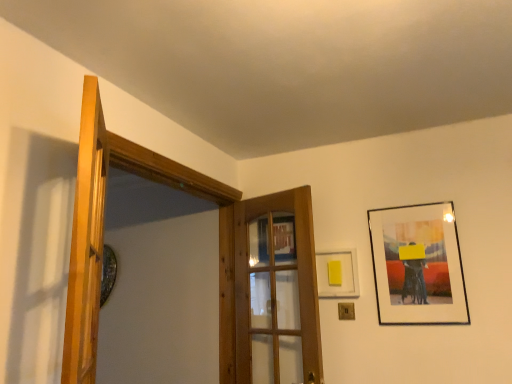
Question: Considering the relative sizes of matte black picture frame at upper right, which is the first picture frame in right-to-left order, and wooden door at center, which is the 2th door in left-to-right order, in the image provided, is matte black picture frame at upper right, which is the first picture frame in right-to-left order, wider than wooden door at center, which is the 2th door in left-to-right order,?

Choices:
 (A) no
 (B) yes

Answer: (A)

Question: Is the position of matte black picture frame at upper right, which is the first picture frame in right-to-left order, less distant than that of wooden door at center, which is the first door from back to front?

Choices:
 (A) no
 (B) yes

Answer: (A)

Question: Is matte black picture frame at upper right, which is the first picture frame in right-to-left order, facing towards wooden door at center, acting as the 1th door starting from the right?

Choices:
 (A) no
 (B) yes

Answer: (A)

Question: From the image's perspective, would you say matte black picture frame at upper right, the second picture frame from the left, is positioned over wooden door at center, arranged as the 2th door when viewed from the front?

Choices:
 (A) no
 (B) yes

Answer: (B)

Question: Is matte black picture frame at upper right, which is the first picture frame in right-to-left order, at the left side of wooden door at center, arranged as the 2th door when viewed from the front?

Choices:
 (A) yes
 (B) no

Answer: (B)

Question: Is wooden door at center, arranged as the 2th door when viewed from the front, inside the boundaries of wooden door at left, the second door viewed from the back, or outside?

Choices:
 (A) inside
 (B) outside

Answer: (B)

Question: Is wooden door at center, which is the 2th door in left-to-right order, bigger or smaller than wooden door at left, the second door viewed from the back?

Choices:
 (A) small
 (B) big

Answer: (B)

Question: In terms of width, does wooden door at center, arranged as the 2th door when viewed from the front, look wider or thinner when compared to wooden door at left, the second door viewed from the back?

Choices:
 (A) wide
 (B) thin

Answer: (B)

Question: From the image's perspective, relative to wooden door at left, the second door from the right, is wooden door at center, which is the first door from back to front, above or below?

Choices:
 (A) below
 (B) above

Answer: (A)

Question: Is yellow matte picture frame at upper right, positioned as the 2th picture frame in right-to-left order, in front of or behind matte black picture frame at upper right, the second picture frame from the left, in the image?

Choices:
 (A) behind
 (B) front

Answer: (A)

Question: Considering the relative positions of yellow matte picture frame at upper right, positioned as the 2th picture frame in right-to-left order, and matte black picture frame at upper right, the second picture frame from the left, in the image provided, is yellow matte picture frame at upper right, positioned as the 2th picture frame in right-to-left order, to the left or to the right of matte black picture frame at upper right, the second picture frame from the left,?

Choices:
 (A) left
 (B) right

Answer: (A)

Question: In terms of size, does yellow matte picture frame at upper right, positioned as the 2th picture frame in right-to-left order, appear bigger or smaller than matte black picture frame at upper right, which is the first picture frame in right-to-left order?

Choices:
 (A) small
 (B) big

Answer: (A)

Question: From a real-world perspective, relative to matte black picture frame at upper right, the second picture frame from the left, is yellow matte picture frame at upper right, the first picture frame positioned from the left, vertically above or below?

Choices:
 (A) above
 (B) below

Answer: (B)

Question: Which is correct: yellow matte picture frame at upper right, positioned as the 2th picture frame in right-to-left order, is inside wooden door at left, which is the 1th door in front-to-back order, or outside of it?

Choices:
 (A) outside
 (B) inside

Answer: (A)

Question: Considering the positions of yellow matte picture frame at upper right, positioned as the 2th picture frame in right-to-left order, and wooden door at left, the second door from the right, in the image, is yellow matte picture frame at upper right, positioned as the 2th picture frame in right-to-left order, wider or thinner than wooden door at left, the second door from the right,?

Choices:
 (A) thin
 (B) wide

Answer: (A)